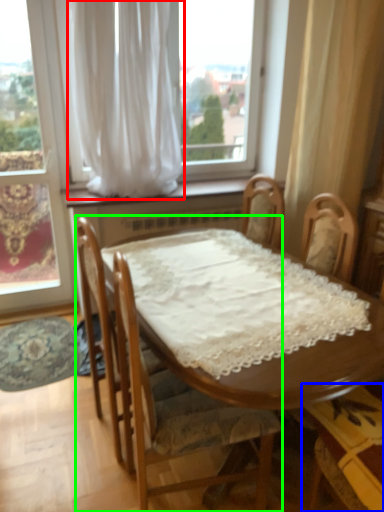
Question: Which object is positioned closest to curtain (highlighted by a red box)? Select from chair (highlighted by a blue box) and chair (highlighted by a green box).

Choices:
 (A) chair
 (B) chair

Answer: (B)